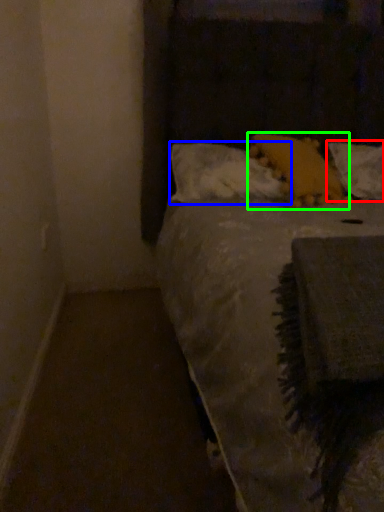
Question: Which object is the farthest from pillow (highlighted by a red box)? Choose among these: pillow (highlighted by a blue box) or pillow (highlighted by a green box).

Choices:
 (A) pillow
 (B) pillow

Answer: (A)